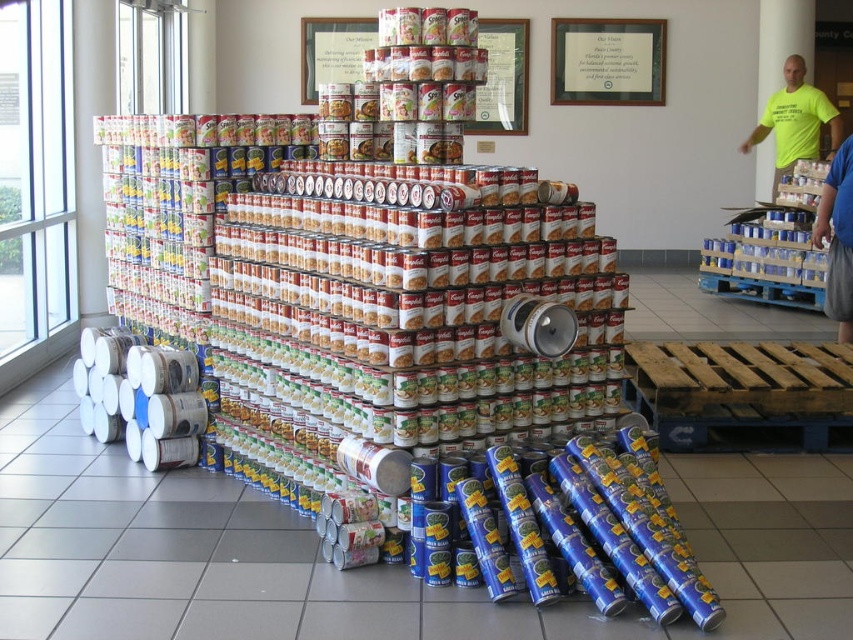
Question: Can you confirm if neon yellow t-shirt at upper right is positioned above blue shirt at lower right?

Choices:
 (A) yes
 (B) no

Answer: (A)

Question: Which object appears farthest from the camera in this image?

Choices:
 (A) blue shirt at lower right
 (B) neon yellow t-shirt at upper right

Answer: (B)

Question: Which point is closer to the camera taking this photo?

Choices:
 (A) (792, 160)
 (B) (843, 188)

Answer: (B)

Question: Where is neon yellow t-shirt at upper right located in relation to blue shirt at lower right in the image?

Choices:
 (A) left
 (B) right

Answer: (B)

Question: Is neon yellow t-shirt at upper right positioned behind blue shirt at lower right?

Choices:
 (A) yes
 (B) no

Answer: (A)